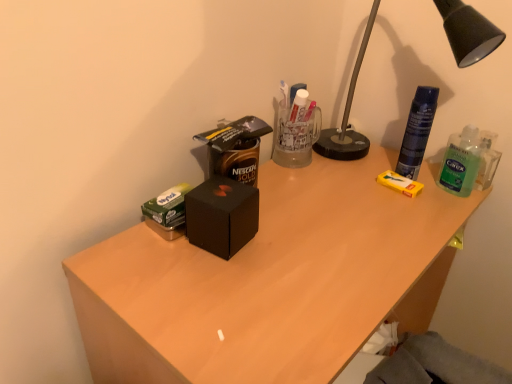
Identify the location of free region on the left part of black matte box at center. The height and width of the screenshot is (384, 512). (138, 253).